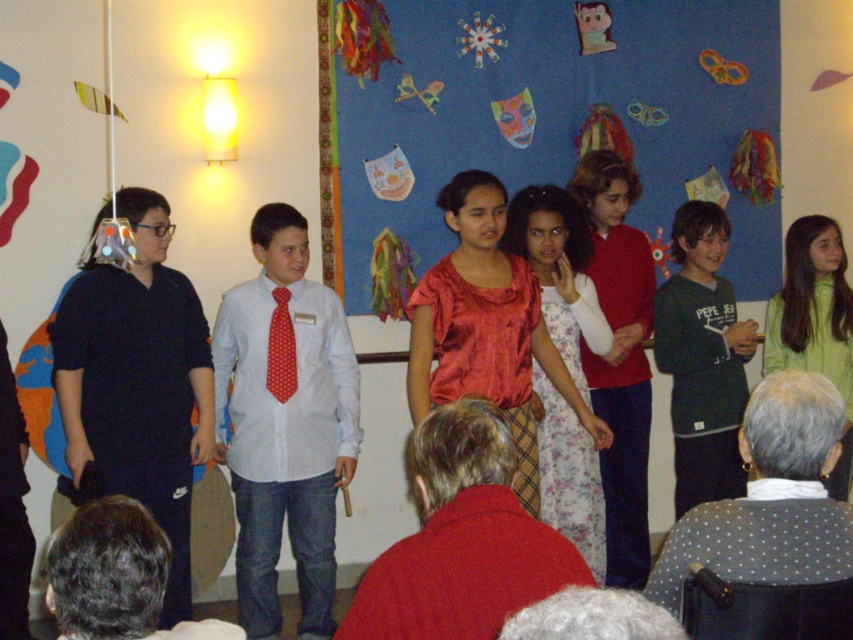
Question: Estimate the real-world distances between objects in this image. Which object is farther from the satin fabric bulletin board at center?

Choices:
 (A) floral dress at center
 (B) red cotton sweater at center
 (C) shiny red blouse at center
 (D) dark green jersey at center

Answer: (B)

Question: Can you confirm if shiny red blouse at center is smaller than dark green jersey at center?

Choices:
 (A) no
 (B) yes

Answer: (A)

Question: Does red cotton sweater at center appear under dark green jersey at center?

Choices:
 (A) yes
 (B) no

Answer: (A)

Question: Which object appears closest to the camera in this image?

Choices:
 (A) red cotton sweater at center
 (B) floral dress at center
 (C) red dotted tie at center

Answer: (A)

Question: Observing the image, what is the correct spatial positioning of red cotton sweater at center in reference to floral dress at center?

Choices:
 (A) right
 (B) left

Answer: (B)

Question: Which is farther from the floral dress at center?

Choices:
 (A) red dotted tie at center
 (B) shiny red blouse at center

Answer: (A)